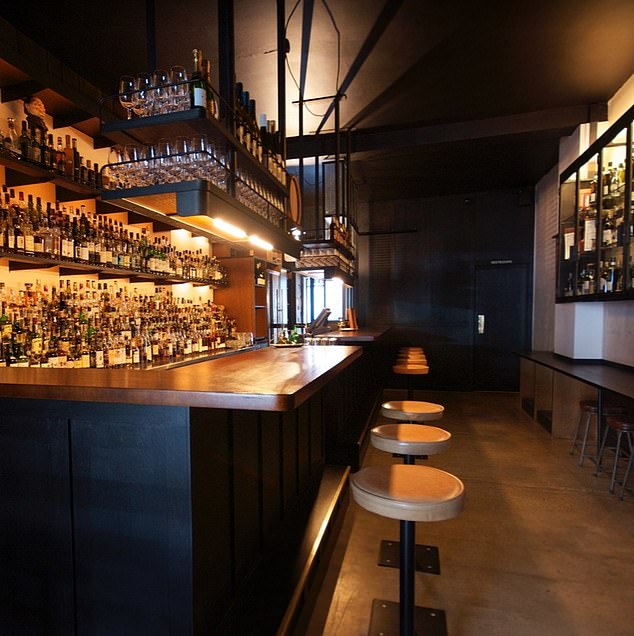
I want to click on door, so click(x=489, y=322).